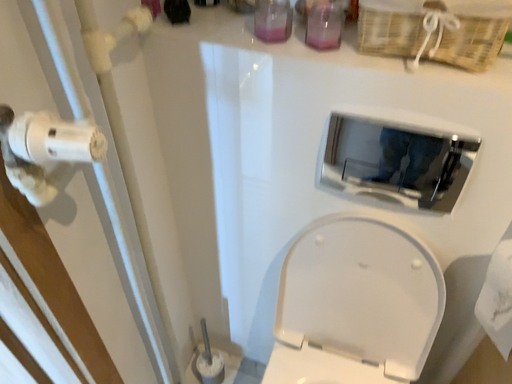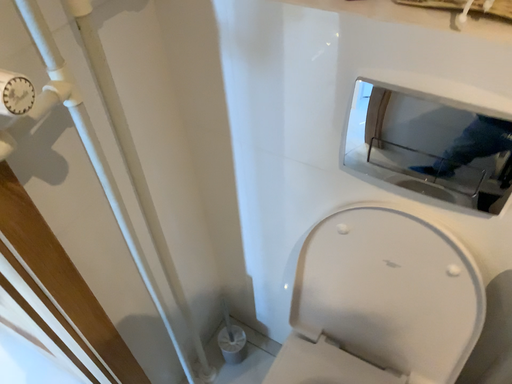
Question: How did the camera likely rotate when shooting the video?

Choices:
 (A) rotated right
 (B) rotated left

Answer: (B)